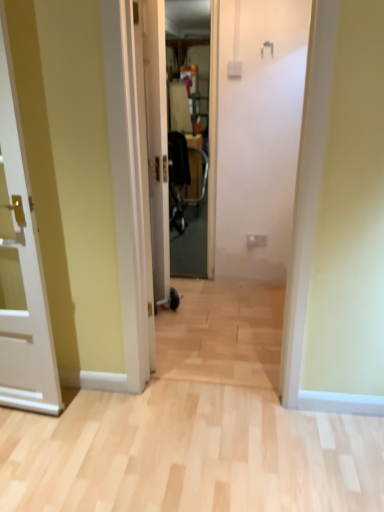
Question: Is transparent plastic screen door at center taller or shorter than white glossy door at center, which is the second door from front to back?

Choices:
 (A) short
 (B) tall

Answer: (B)

Question: Choose the correct answer: Is transparent plastic screen door at center inside white glossy door at center, which is the second door from front to back, or outside it?

Choices:
 (A) inside
 (B) outside

Answer: (B)

Question: Estimate the real-world distances between objects in this image. Which object is closer to the white glossy door at center, which is the second door from front to back?

Choices:
 (A) white glossy door at left, the first door from the front
 (B) transparent plastic screen door at center

Answer: (A)

Question: Based on their relative distances, which object is farther from the white glossy door at center, which is the 1th door from back to front?

Choices:
 (A) transparent plastic screen door at center
 (B) white glossy door at left, the 1th door from the left

Answer: (A)